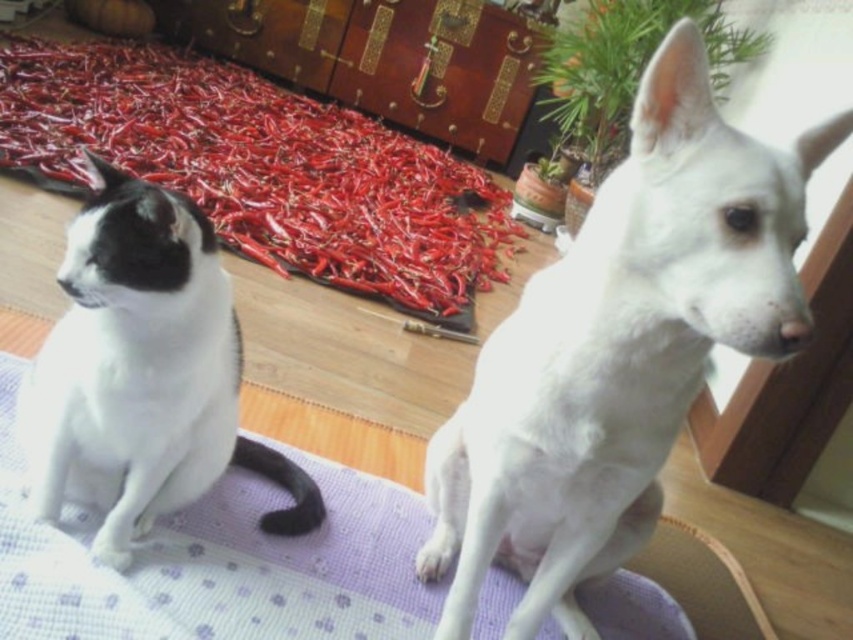
Looking at this image, you are a photographer holding a camera. You see the white fur dog at upper right in the scene. Can you capture the dog in a single photo without moving the camera? Explain why or why not.

The white fur dog at upper right and the camera are 26.52 inches apart. Since the distance between them is within the camera lens range, you can capture the dog in a single photo without moving the camera.

You are trying to place a new rug in the same area where the purple fabric mat at center and the white fur cat at left are. If the rug must be wider than both objects, what should its minimum width be?

The purple fabric mat at center is wider than the white fur cat at left. Therefore, the rug must be wider than the purple fabric mat at center to satisfy the requirement.